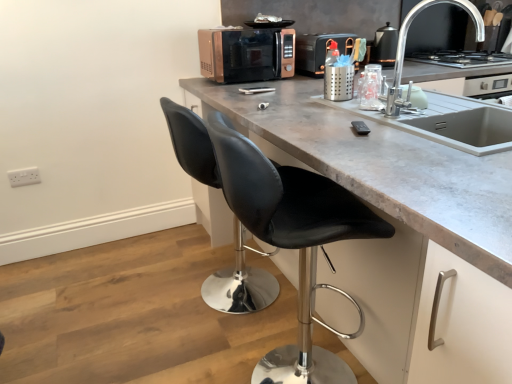
The height and width of the screenshot is (384, 512). Identify the location of free space that is to the left of black leather swivel chair at center. (139, 299).